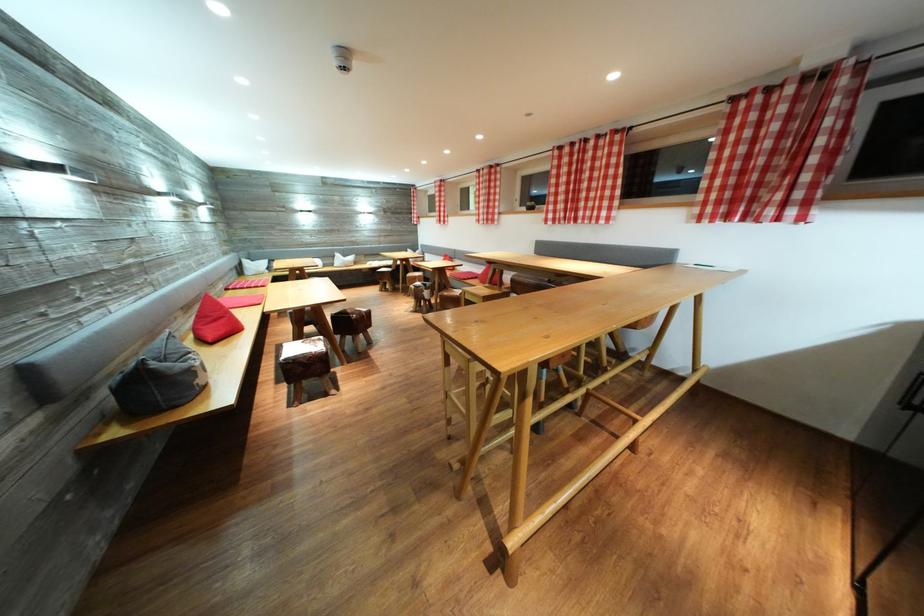
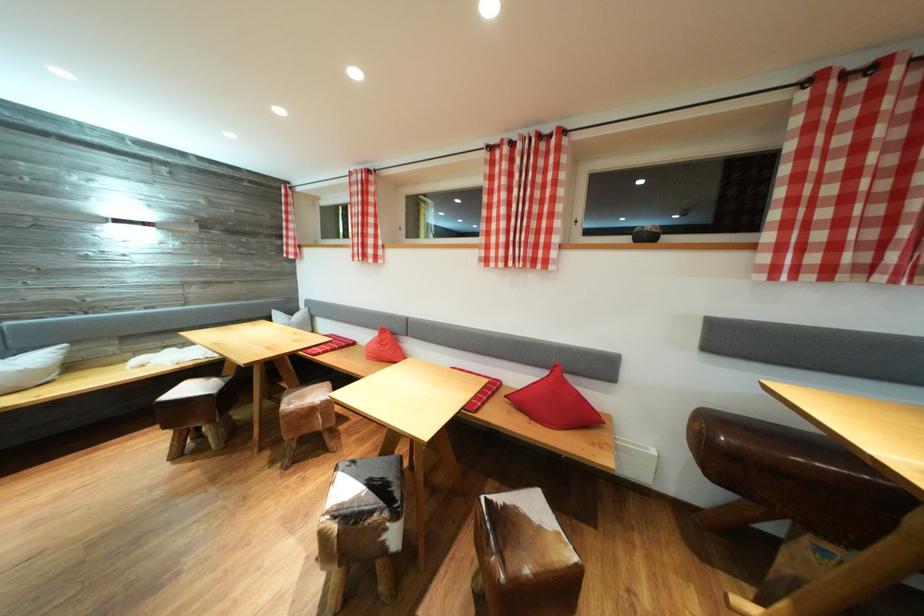
In the second image, find the point that corresponds to [351,261] in the first image.

(14, 358)